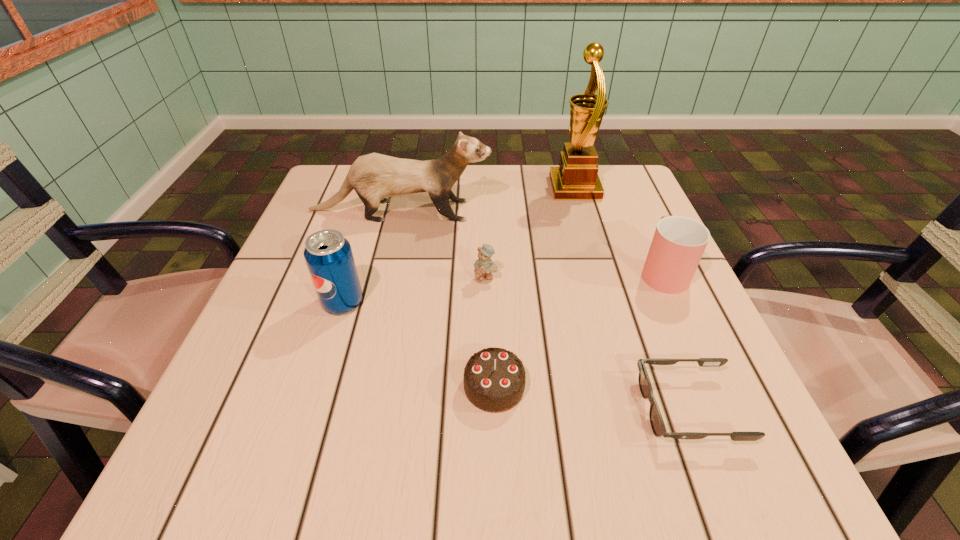
Find the location of a particular element. The width and height of the screenshot is (960, 540). award that is at the far edge is located at coordinates (576, 178).

You are a GUI agent. You are given a task and a screenshot of the screen. Output one action in this format:
    pyautogui.click(x=<x>, y=<y>)
    Task: Click on the ferret located at the far edge
    This screenshot has width=960, height=540.
    Given the screenshot: What is the action you would take?
    pyautogui.click(x=374, y=177)

Locate an element on the screen. The height and width of the screenshot is (540, 960). object present at the near edge is located at coordinates (658, 427).

The width and height of the screenshot is (960, 540). I want to click on ferret present at the left edge, so click(374, 177).

At what (x,y) coordinates should I click in order to perform the action: click on pop soda that is at the left edge. Please return your answer as a coordinate pair (x, y). Looking at the image, I should click on (328, 254).

You are a GUI agent. You are given a task and a screenshot of the screen. Output one action in this format:
    pyautogui.click(x=<x>, y=<y>)
    Task: Click on the award that is at the right edge
    The width and height of the screenshot is (960, 540).
    Given the screenshot: What is the action you would take?
    pyautogui.click(x=576, y=178)

I want to click on cup present at the right edge, so click(x=678, y=244).

The image size is (960, 540). I want to click on sunglasses that is at the right edge, so click(x=658, y=427).

The width and height of the screenshot is (960, 540). What are the coordinates of `object present at the far left corner` in the screenshot? It's located at (374, 177).

This screenshot has width=960, height=540. Identify the location of object that is positioned at the far right corner. (576, 178).